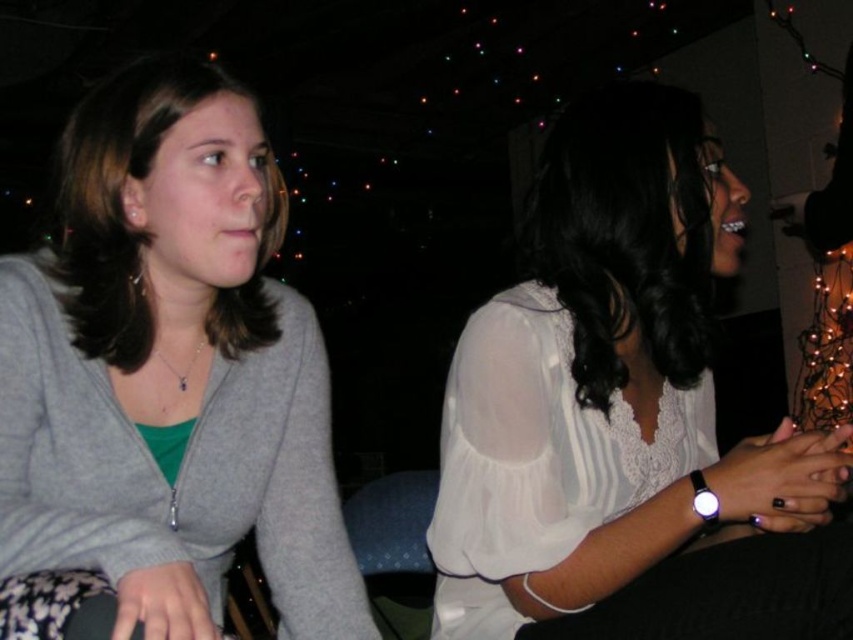
Based on the photo, does matte gray sweater at left appear under white sheer blouse at center?

No, matte gray sweater at left is not below white sheer blouse at center.

Can you confirm if matte gray sweater at left is positioned to the right of white sheer blouse at center?

No, matte gray sweater at left is not to the right of white sheer blouse at center.

The height and width of the screenshot is (640, 853). What do you see at coordinates (165, 381) in the screenshot?
I see `matte gray sweater at left` at bounding box center [165, 381].

Identify the location of matte gray sweater at left. The width and height of the screenshot is (853, 640). (165, 381).